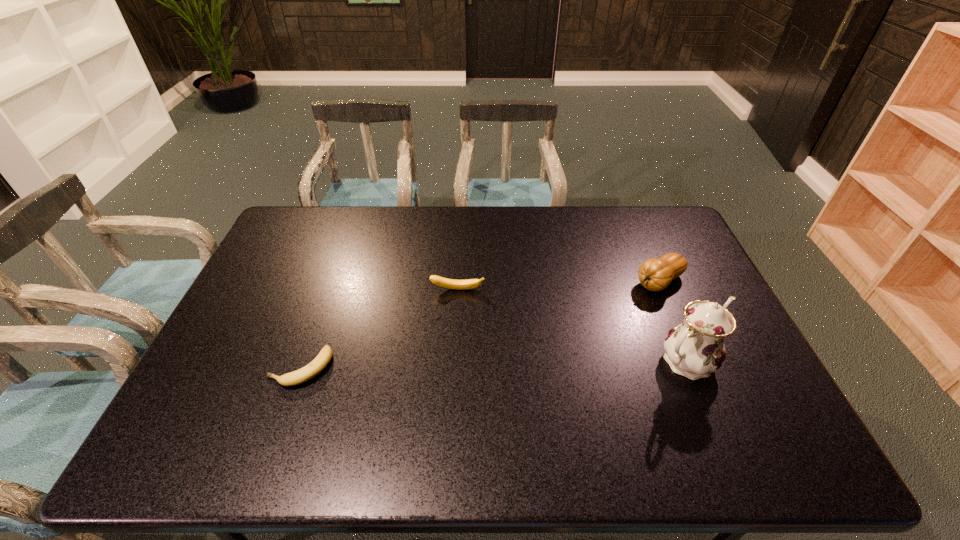
Identify the location of free space on the desktop that is between the leftmost object and the tallest object and is positioned at the stem of the farther banana. This screenshot has height=540, width=960. (455, 365).

Where is `free space on the desktop that is between the leftmost object and the chinaware and is positioned on the stem side of the third shortest object`? free space on the desktop that is between the leftmost object and the chinaware and is positioned on the stem side of the third shortest object is located at coordinates tap(531, 363).